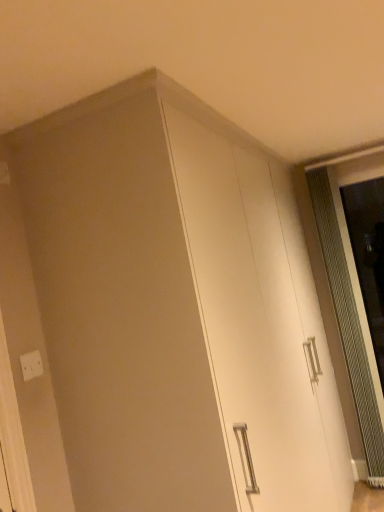
Question: Is white glossy cabinet at center not near white plastic electric outlet at lower left?

Choices:
 (A) no
 (B) yes

Answer: (B)

Question: Is white glossy cabinet at center to the right of white plastic electric outlet at lower left from the viewer's perspective?

Choices:
 (A) no
 (B) yes

Answer: (B)

Question: Considering the relative sizes of white glossy cabinet at center and white plastic electric outlet at lower left in the image provided, is white glossy cabinet at center bigger than white plastic electric outlet at lower left?

Choices:
 (A) no
 (B) yes

Answer: (B)

Question: Is white plastic electric outlet at lower left a part of white glossy cabinet at center?

Choices:
 (A) yes
 (B) no

Answer: (B)

Question: Considering the relative sizes of white glossy cabinet at center and white plastic electric outlet at lower left in the image provided, is white glossy cabinet at center thinner than white plastic electric outlet at lower left?

Choices:
 (A) no
 (B) yes

Answer: (A)

Question: Is white glossy cabinet at center aimed at white plastic electric outlet at lower left?

Choices:
 (A) no
 (B) yes

Answer: (A)

Question: From a real-world perspective, is clear glass screen door at right below white plastic electric outlet at lower left?

Choices:
 (A) yes
 (B) no

Answer: (A)

Question: Is clear glass screen door at right next to white plastic electric outlet at lower left?

Choices:
 (A) yes
 (B) no

Answer: (B)

Question: Is clear glass screen door at right to the left of white plastic electric outlet at lower left from the viewer's perspective?

Choices:
 (A) no
 (B) yes

Answer: (A)

Question: From the image's perspective, would you say clear glass screen door at right is shown under white plastic electric outlet at lower left?

Choices:
 (A) no
 (B) yes

Answer: (A)

Question: Does clear glass screen door at right have a lesser width compared to white plastic electric outlet at lower left?

Choices:
 (A) yes
 (B) no

Answer: (B)

Question: Is clear glass screen door at right facing towards white plastic electric outlet at lower left?

Choices:
 (A) no
 (B) yes

Answer: (A)

Question: Can you confirm if white glossy cabinet at center is bigger than clear glass screen door at right?

Choices:
 (A) yes
 (B) no

Answer: (A)